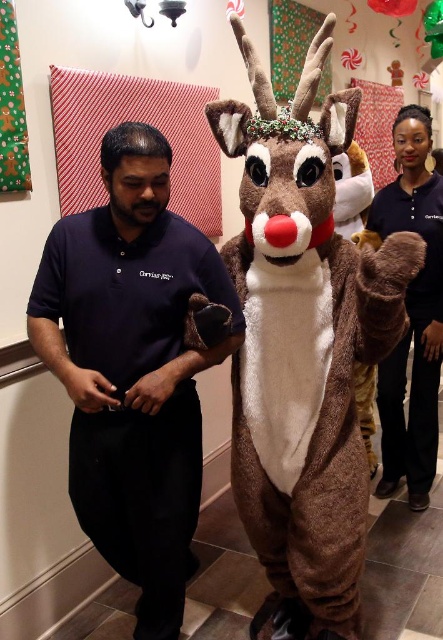
You are standing in the festive indoor setting and want to locate the point at coordinates (303, 348). Which object in the scene does this point fall on?

The point at coordinates (303, 348) falls on the fuzzy brown reindeer at center.

Based on the photo, you are organizing a holiday party and need to place the fuzzy brown reindeer at center and the brown plush reindeer at center on a shelf. Which one should you place first to ensure both fit properly?

The fuzzy brown reindeer at center is larger in size than the brown plush reindeer at center, so you should place the fuzzy brown reindeer at center first to ensure both fit properly on the shelf.

You are a photographer at the event and need to capture a photo where both the fuzzy brown reindeer at center and the dark blue cotton shirt at center are visible. Considering their sizes, which object should be placed closer to the camera to ensure both are in frame?

The fuzzy brown reindeer at center is taller than the dark blue cotton shirt at center. To ensure both are visible in the photo, position the fuzzy brown reindeer at center slightly farther from the camera so that its larger size balances with the smaller dark blue cotton shirt at center, keeping both within the frame.